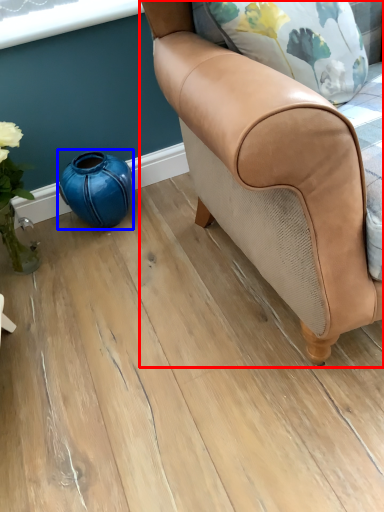
Question: Among these objects, which one is nearest to the camera, chair (highlighted by a red box) or teal (highlighted by a blue box)?

Choices:
 (A) chair
 (B) teal

Answer: (A)